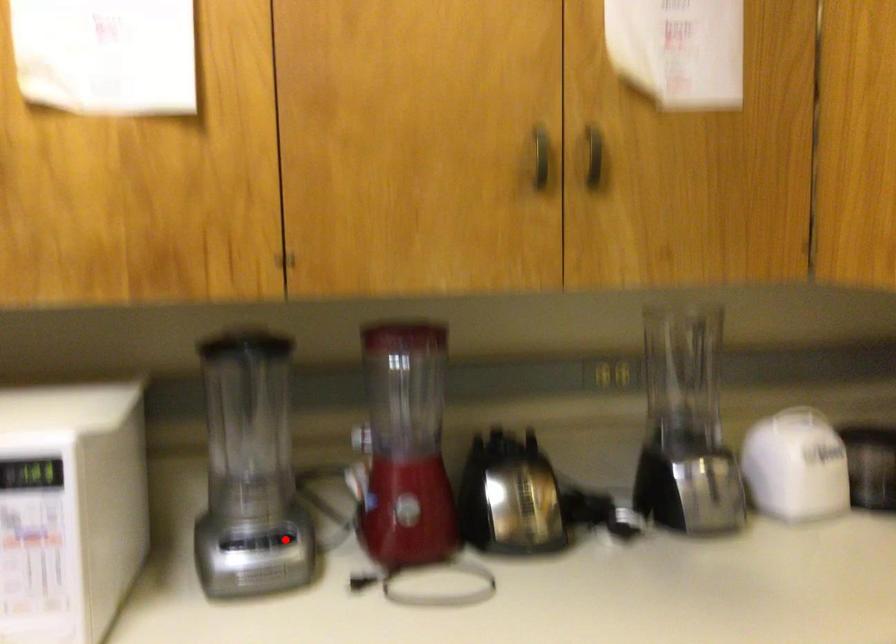
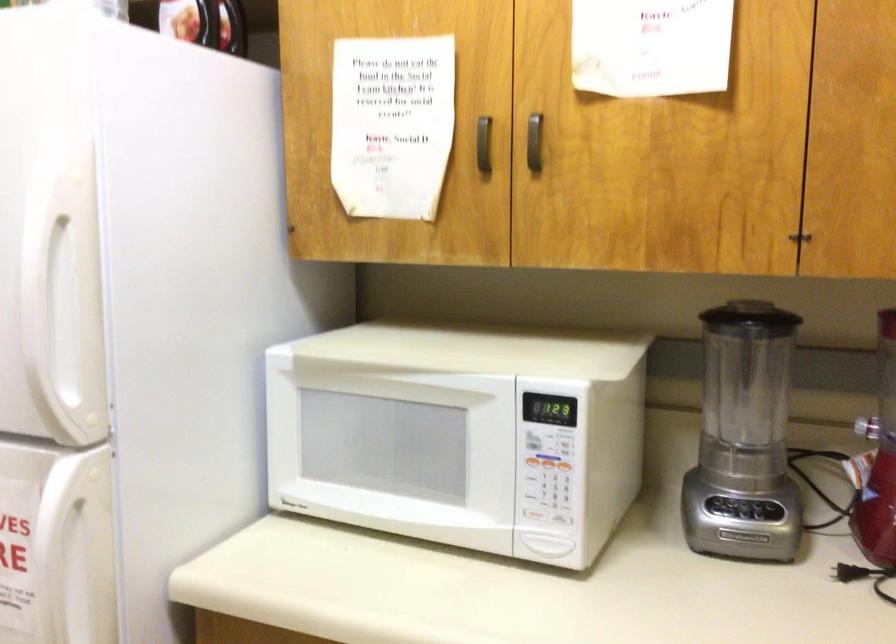
The point at the highlighted location is marked in the first image. Where is the corresponding point in the second image?

(771, 509)